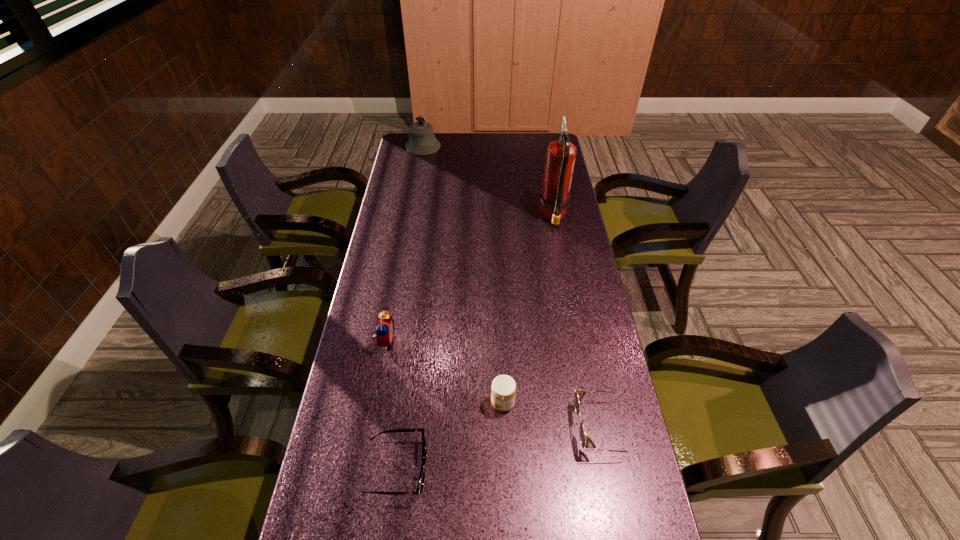
You are a GUI agent. You are given a task and a screenshot of the screen. Output one action in this format:
    pyautogui.click(x=<x>, y=<y>)
    Task: Click on the free region located 0.210m on the front lenses of the taller sunglasses
    This screenshot has height=540, width=960.
    Given the screenshot: What is the action you would take?
    pyautogui.click(x=493, y=428)

This screenshot has height=540, width=960. I want to click on free space located 0.190m on the front lenses of the taller sunglasses, so click(502, 428).

Identify the location of vacant area located 0.400m on the front-facing side of the shorter sunglasses. (595, 468).

I want to click on object positioned at the far edge, so tap(422, 141).

This screenshot has height=540, width=960. What are the coordinates of `bell present at the left edge` in the screenshot? It's located at (422, 141).

Identify the location of alarm clock located at the left edge. Image resolution: width=960 pixels, height=540 pixels. (385, 329).

Locate an element on the screen. The width and height of the screenshot is (960, 540). sunglasses that is at the left edge is located at coordinates (420, 485).

Find the location of `fire extinguisher present at the right edge`. fire extinguisher present at the right edge is located at coordinates (560, 155).

Locate an element on the screen. The width and height of the screenshot is (960, 540). sunglasses that is at the right edge is located at coordinates (579, 394).

The width and height of the screenshot is (960, 540). What are the coordinates of `object that is at the far left corner` in the screenshot? It's located at (422, 141).